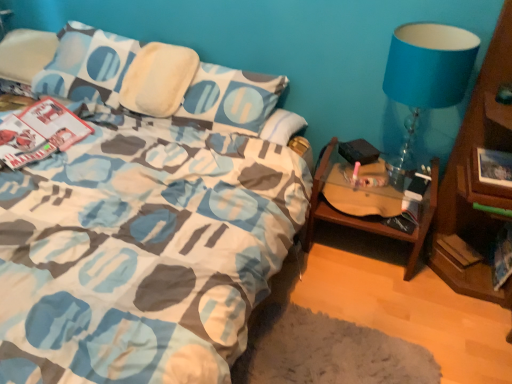
Where is `hardcover book at lower right`? hardcover book at lower right is located at coordinates (458, 249).

In the scene shown: Is blue fabric lampshade at upper right in contact with woodenobject at right?

There is a gap between blue fabric lampshade at upper right and woodenobject at right.

In order to click on table on the left of blue fabric lampshade at upper right in this screenshot , I will do `click(369, 216)`.

From a real-world perspective, relative to woodenobject at right, is blue fabric lampshade at upper right vertically above or below?

In terms of real-world spatial position, blue fabric lampshade at upper right is above woodenobject at right.

Can you tell me how much blue fabric lampshade at upper right and woodenobject at right differ in facing direction?

The angle between the facing direction of blue fabric lampshade at upper right and the facing direction of woodenobject at right is 1.15 degrees.

Which is behind, point (390, 230) or point (411, 27)?

The point (390, 230) is farther from the camera.

I want to click on table below the blue fabric lampshade at upper right (from the image's perspective), so click(369, 216).

Considering the relative positions of woodenobject at right and blue fabric lampshade at upper right in the image provided, is woodenobject at right in front of blue fabric lampshade at upper right?

No, woodenobject at right is further to the viewer.

Can you tell me how much woodenobject at right and blue fabric lampshade at upper right differ in facing direction?

1.15 degrees.

Is blue fabric lampshade at upper right inside or outside of hardcover book at lower right?

blue fabric lampshade at upper right is not inside hardcover book at lower right, it's outside.

Looking at this image, is blue fabric lampshade at upper right wider than hardcover book at lower right?

Indeed, blue fabric lampshade at upper right has a greater width compared to hardcover book at lower right.

Consider the image. Is blue fabric lampshade at upper right oriented towards hardcover book at lower right?

No, blue fabric lampshade at upper right is not turned towards hardcover book at lower right.

Is blue fabric lampshade at upper right closer to camera compared to hardcover book at lower right?

Yes, it is in front of hardcover book at lower right.

Does point (321, 189) come closer to viewer compared to point (461, 245)?

Yes, it is.

Consider the image. Considering the relative positions of woodenobject at right and hardcover book at lower right in the image provided, is woodenobject at right to the left of hardcover book at lower right from the viewer's perspective?

Indeed, woodenobject at right is positioned on the left side of hardcover book at lower right.

Would you say woodenobject at right is a long distance from hardcover book at lower right?

woodenobject at right is actually quite close to hardcover book at lower right.

From a real-world perspective, is hardcover book at lower right positioned above or below woodenobject at right?

In terms of real-world spatial position, hardcover book at lower right is below woodenobject at right.

Can woodenobject at right be found inside hardcover book at lower right?

No, hardcover book at lower right does not contain woodenobject at right.

Is woodenobject at right at the back of hardcover book at lower right?

That's not correct — hardcover book at lower right is not looking away from woodenobject at right.

The width and height of the screenshot is (512, 384). Identify the location of table in front of the hardcover book at lower right. (369, 216).

Is blue fabric lampshade at upper right located within hardcover book at lower right?

No, hardcover book at lower right does not contain blue fabric lampshade at upper right.

Between point (459, 260) and point (392, 172), which one is positioned in front?

Positioned in front is point (459, 260).

The height and width of the screenshot is (384, 512). Identify the location of table that appears below the blue fabric lampshade at upper right (from a real-world perspective). (369, 216).

At what (x,y) coordinates should I click in order to perform the action: click on lamp in front of the woodenobject at right. Please return your answer as a coordinate pair (x, y). Image resolution: width=512 pixels, height=384 pixels. Looking at the image, I should click on (426, 76).

Looking at the image, which one is located further to blue fabric lampshade at upper right, hardcover book at lower right or woodenobject at right?

hardcover book at lower right lies further to blue fabric lampshade at upper right than the other object.

When comparing their distances from hardcover book at lower right, does blue fabric lampshade at upper right or woodenobject at right seem closer?

woodenobject at right is closer to hardcover book at lower right.

When comparing their distances from woodenobject at right, does hardcover book at lower right or blue fabric lampshade at upper right seem closer?

hardcover book at lower right is closer to woodenobject at right.

Which object lies further to the anchor point woodenobject at right, blue fabric lampshade at upper right or hardcover book at lower right?

blue fabric lampshade at upper right is further to woodenobject at right.

Based on their spatial positions, is woodenobject at right or hardcover book at lower right further from blue fabric lampshade at upper right?

Based on the image, hardcover book at lower right appears to be further to blue fabric lampshade at upper right.

Looking at the image, which one is located closer to hardcover book at lower right, woodenobject at right or blue fabric lampshade at upper right?

woodenobject at right lies closer to hardcover book at lower right than the other object.

I want to click on table between blue fabric lampshade at upper right and hardcover book at lower right in the vertical direction, so click(369, 216).